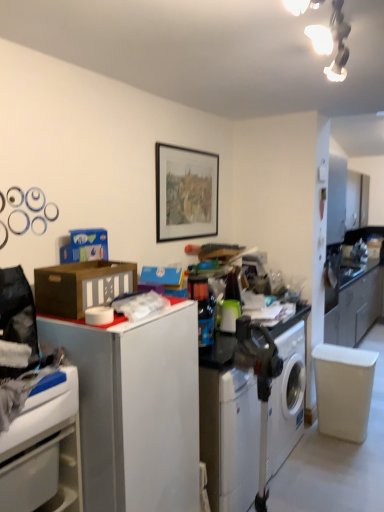
Question: Considering the positions of matte black picture frame at center and white matte file cabinet at left in the image, is matte black picture frame at center taller or shorter than white matte file cabinet at left?

Choices:
 (A) short
 (B) tall

Answer: (A)

Question: From the image's perspective, is matte black picture frame at center located above or below white matte file cabinet at left?

Choices:
 (A) above
 (B) below

Answer: (A)

Question: Which of these objects is positioned closest to the brown cardboard box at left?

Choices:
 (A) white matte file cabinet at left
 (B) white glossy cabinet at lower left
 (C) matte black picture frame at center
 (D) white plastic washing machine at lower center

Answer: (A)

Question: Considering the real-world distances, which object is closest to the white plastic washing machine at lower center?

Choices:
 (A) white matte file cabinet at left
 (B) matte black picture frame at center
 (C) white glossy cabinet at lower left
 (D) brown cardboard box at left

Answer: (A)